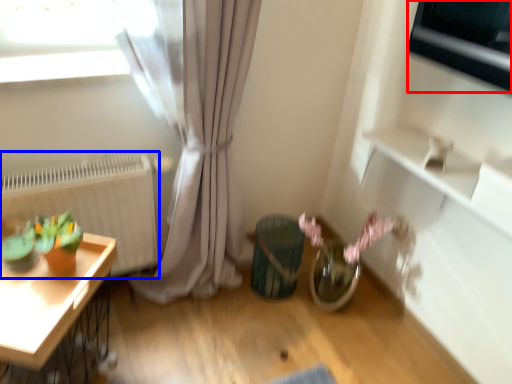
Question: Which object is closer to the camera taking this photo, appliance (highlighted by a red box) or radiator (highlighted by a blue box)?

Choices:
 (A) appliance
 (B) radiator

Answer: (A)